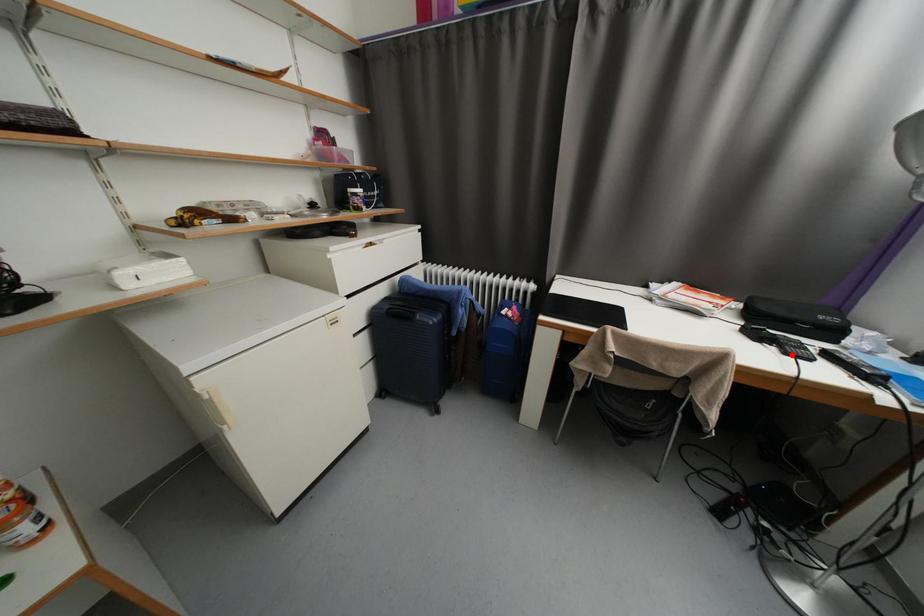
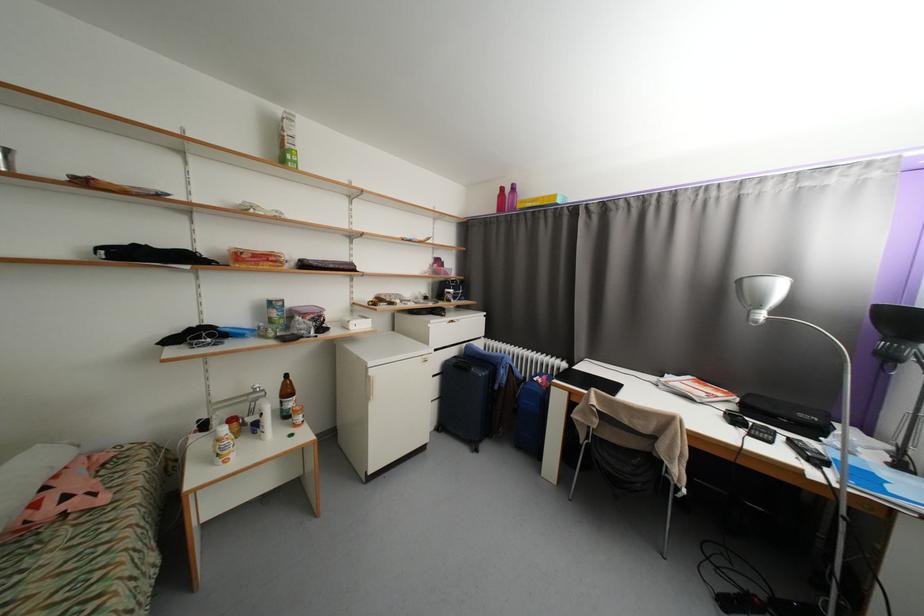
Locate, in the second image, the point that corresponds to the highlighted location in the first image.

(757, 436)